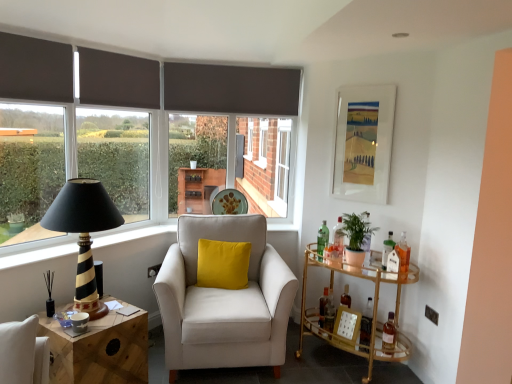
Identify the location of free spot above matte brown curtain at left (from a real-world perspective). This screenshot has height=384, width=512. (122, 52).